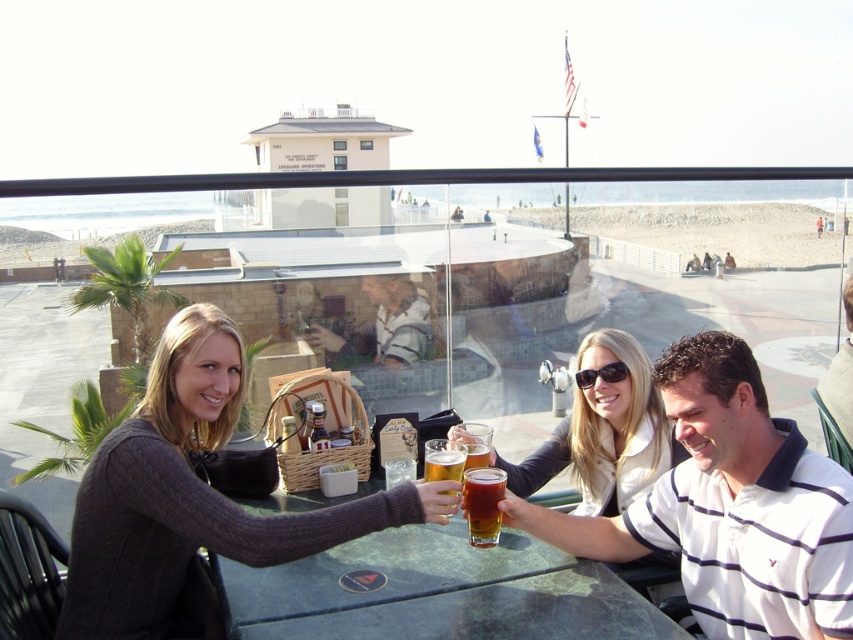
Question: Can you confirm if matte black jacket at center is thinner than black plastic sunglasses at upper center?

Choices:
 (A) yes
 (B) no

Answer: (B)

Question: Among these objects, which one is nearest to the camera?

Choices:
 (A) black plastic sunglasses at upper center
 (B) white striped polo shirt at center
 (C) dark gray sweater at center

Answer: (B)

Question: Which of the following is the farthest from the observer?

Choices:
 (A) (476, 493)
 (B) (735, 476)
 (C) (549, 458)

Answer: (C)

Question: Which point is farther to the camera?

Choices:
 (A) matte black jacket at center
 (B) black plastic sunglasses at upper center
 (C) translucent glass beer at center

Answer: (B)

Question: Can you confirm if white striped polo shirt at center is positioned to the right of green marble table at center?

Choices:
 (A) yes
 (B) no

Answer: (A)

Question: Does white striped polo shirt at center have a smaller size compared to green marble table at center?

Choices:
 (A) yes
 (B) no

Answer: (B)